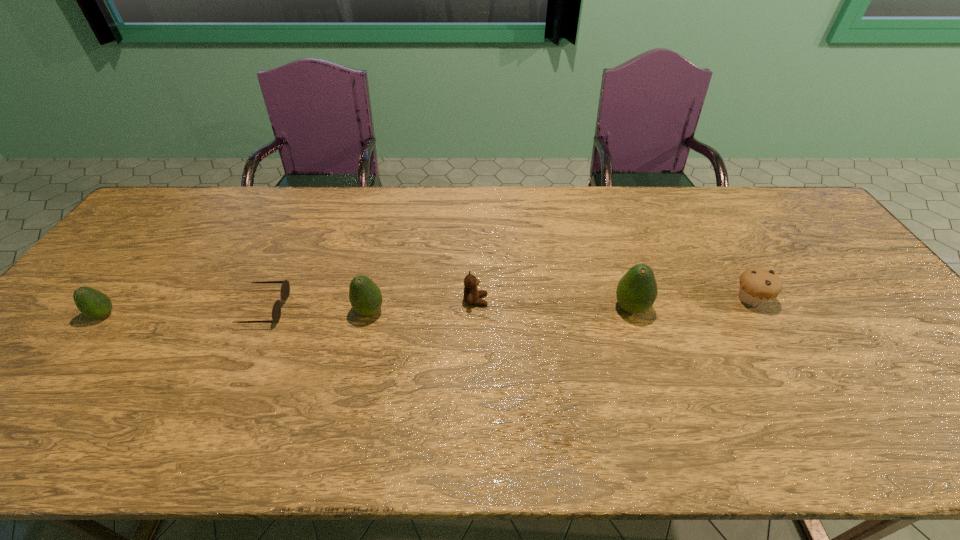
This screenshot has width=960, height=540. Find the location of `free space between the second tallest object and the fifth object from left to right`. free space between the second tallest object and the fifth object from left to right is located at coordinates (500, 310).

Image resolution: width=960 pixels, height=540 pixels. Find the location of `vacant area that lies between the rightmost object and the fifth object from right to left`. vacant area that lies between the rightmost object and the fifth object from right to left is located at coordinates (508, 303).

Find the location of a particular element. object that can be found as the fifth closest to the muffin is located at coordinates (92, 303).

Identify the location of object that is the third closest to the teddy bear. (285, 288).

Identify which avocado is located as the nearest to the tallest object. Please provide its 2D coordinates. Your answer should be formatted as a tuple, i.e. [(x, y)], where the tuple contains the x and y coordinates of a point satisfying the conditions above.

[(365, 297)]

The image size is (960, 540). I want to click on avocado that can be found as the third closest to the rightmost object, so click(92, 303).

Locate an element on the screen. free region that satisfies the following two spatial constraints: 1. on the front-facing side of the second avocado from right to left; 2. on the right side of the fifth object from right to left is located at coordinates pos(264,312).

The height and width of the screenshot is (540, 960). What are the coordinates of `vacant area in the image that satisfies the following two spatial constraints: 1. at the face of the fourth object from left to right; 2. on the back side of the rightmost avocado` in the screenshot? It's located at 475,308.

Where is `blank area in the image that satisfies the following two spatial constraints: 1. on the back side of the muffin; 2. on the left side of the fifth shortest object`? blank area in the image that satisfies the following two spatial constraints: 1. on the back side of the muffin; 2. on the left side of the fifth shortest object is located at coordinates (372, 299).

This screenshot has width=960, height=540. I want to click on vacant point that satisfies the following two spatial constraints: 1. on the front-facing side of the shortest object; 2. on the back side of the fifth shortest object, so click(x=264, y=312).